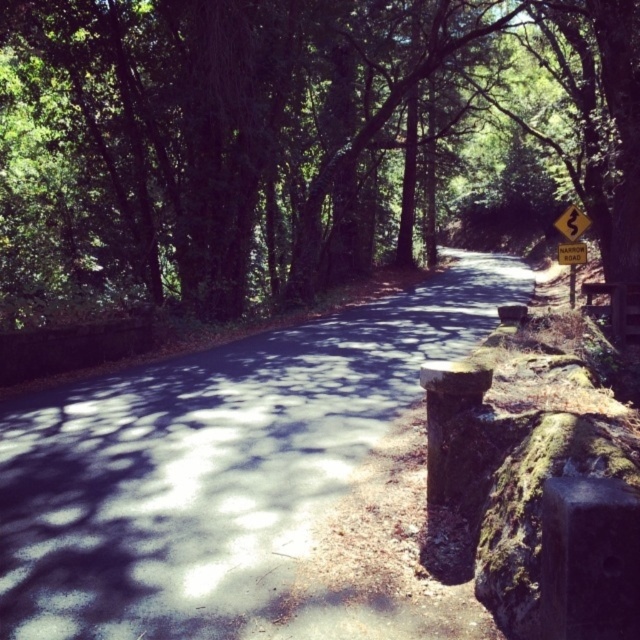
Question: Which point is closer to the camera taking this photo?

Choices:
 (A) (566, 230)
 (B) (577, 250)
 (C) (580, 243)
 (D) (52, 264)

Answer: (B)

Question: Which object is closer to the camera taking this photo?

Choices:
 (A) yellow paper sign at upper right
 (B) green leafy tree at upper center

Answer: (B)

Question: From the image, what is the correct spatial relationship of yellow paper sign at upper right in relation to yellow reflective plastic road sign at upper right?

Choices:
 (A) left
 (B) right

Answer: (A)

Question: Is yellow reflective plastic road sign at upper right to the right of yellowmaterial/texturenarrow road sign at right from the viewer's perspective?

Choices:
 (A) no
 (B) yes

Answer: (B)

Question: Which object is farther from the camera taking this photo?

Choices:
 (A) yellow paper sign at upper right
 (B) green leafy tree at upper center
 (C) yellow reflective plastic road sign at upper right
 (D) yellowmaterial/texturenarrow road sign at right

Answer: (C)

Question: Considering the relative positions of yellow paper sign at upper right and yellow reflective plastic road sign at upper right in the image provided, where is yellow paper sign at upper right located with respect to yellow reflective plastic road sign at upper right?

Choices:
 (A) below
 (B) above

Answer: (A)